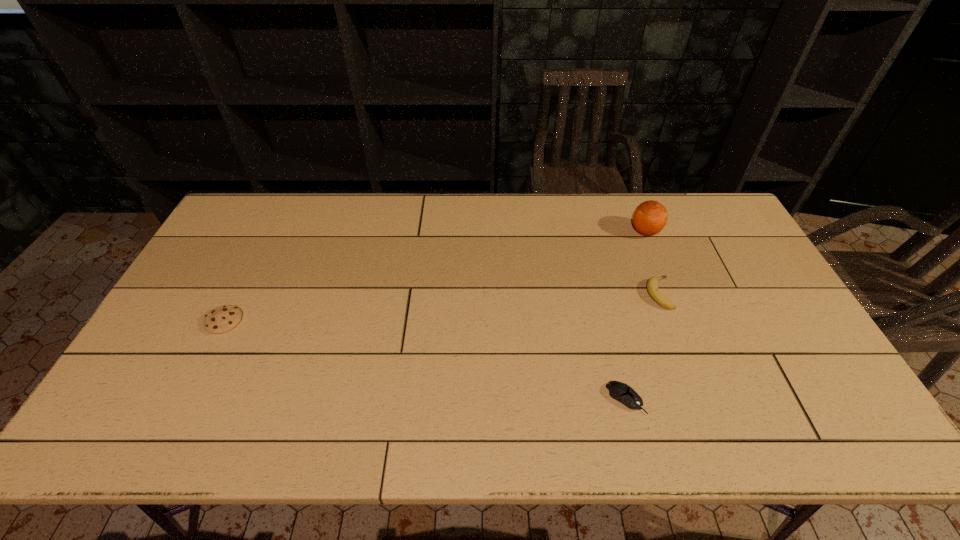
At what (x,y) coordinates should I click in order to perform the action: click on vacant space that's between the banana and the computer mouse. Please return your answer as a coordinate pair (x, y). This screenshot has width=960, height=540. Looking at the image, I should click on (642, 346).

Where is `vacant region between the tallest object and the banana`? The width and height of the screenshot is (960, 540). vacant region between the tallest object and the banana is located at coordinates (653, 262).

Find the location of a particular element. empty space that is in between the leftmost object and the nearest object is located at coordinates (424, 360).

Image resolution: width=960 pixels, height=540 pixels. I want to click on free spot between the third object from right to left and the orange, so click(636, 315).

At what (x,y) coordinates should I click in order to perform the action: click on free spot between the farthest object and the nearest object. Please return your answer as a coordinate pair (x, y). Looking at the image, I should click on (636, 315).

Where is `vacant point located between the banana and the tallest object`? vacant point located between the banana and the tallest object is located at coordinates (653, 262).

The image size is (960, 540). What are the coordinates of `blank region between the nearest object and the orange` in the screenshot? It's located at (636, 315).

Identify the location of free point between the second object from left to right and the cookie. The width and height of the screenshot is (960, 540). click(x=424, y=360).

You are a GUI agent. You are given a task and a screenshot of the screen. Output one action in this format:
    pyautogui.click(x=<x>, y=<y>)
    Task: Click on the free space between the banana and the second object from left to right
    Image resolution: width=960 pixels, height=540 pixels.
    Given the screenshot: What is the action you would take?
    pyautogui.click(x=642, y=346)

Identify which object is the closest to the orange. Please provide its 2D coordinates. Your answer should be formatted as a tuple, i.e. [(x, y)], where the tuple contains the x and y coordinates of a point satisfying the conditions above.

[(652, 285)]